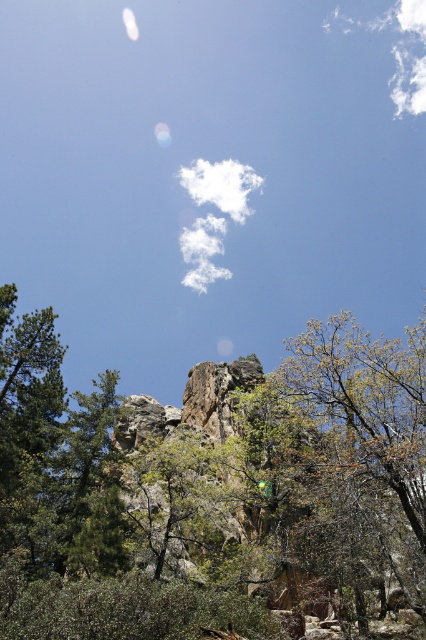
You are an artist sketching this landscape. You want to draw the green matte tree at left and the white fluffy cloud at upper center. Which one should you draw first if you want to start with the narrower object?

The green matte tree at left is thinner than the white fluffy cloud at upper center, so you should draw the green matte tree at left first since it is narrower.

You are standing at the base of the rocky cliff and looking towards the dense collection of trees and shrubs. There is a point marked at coordinates point (54, 454). What is the object located at this point?

The point (54, 454) corresponds to the green matte tree at left.

You are a bird soaring above the rocky cliff. You spot the green matte tree at left and the white fluffy cloud at upper right. Which object is closer to the ground?

The green matte tree at left is closer to the ground than the white fluffy cloud at upper right because it has a lesser height compared to the cloud.